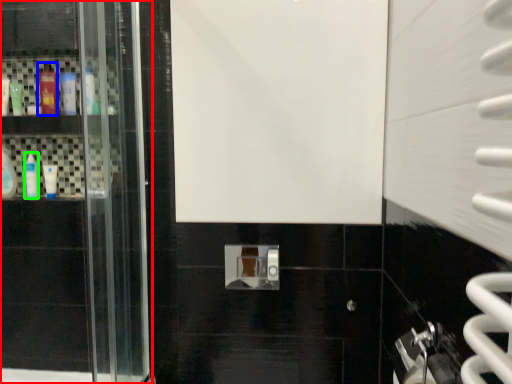
Question: Which object is positioned closest to door (highlighted by a red box)? Select from mouthwash (highlighted by a blue box) and mouthwash (highlighted by a green box).

Choices:
 (A) mouthwash
 (B) mouthwash

Answer: (B)